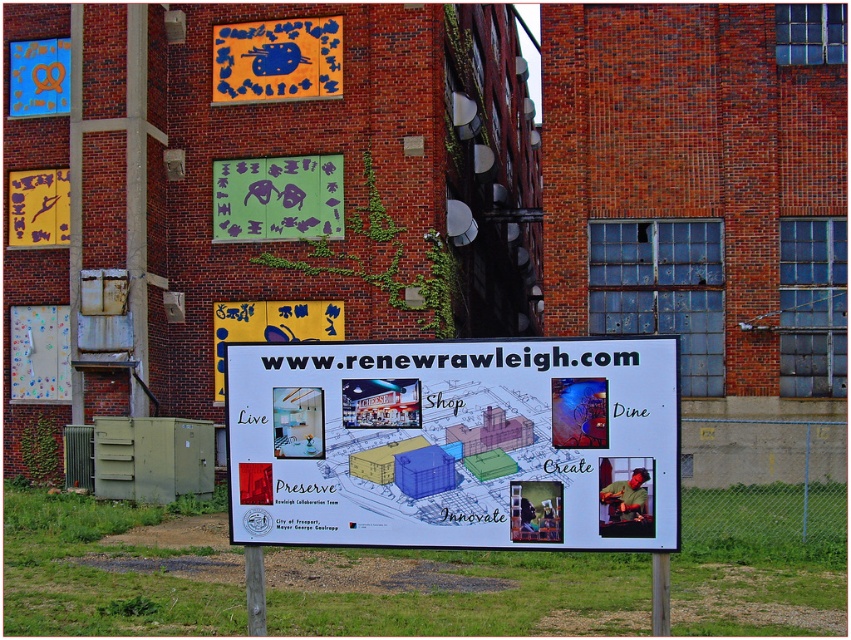
Question: Which object is positioned closest to the white paper sign at center?

Choices:
 (A) matte blue pretzel at upper left
 (B) green matte sign at center
 (C) yellow matte sign at center
 (D) blue fabric sign at upper center

Answer: (C)

Question: Does yellow matte sign at center appear on the left side of yellow matte sign at upper left?

Choices:
 (A) yes
 (B) no

Answer: (B)

Question: Does yellow matte sign at center have a smaller size compared to matte blue pretzel at upper left?

Choices:
 (A) yes
 (B) no

Answer: (B)

Question: Is white paper sign at center bigger than blue fabric sign at upper center?

Choices:
 (A) no
 (B) yes

Answer: (A)

Question: Which point is closer to the camera?

Choices:
 (A) yellow matte sign at center
 (B) matte blue pretzel at upper left
 (C) white paper sign at center

Answer: (C)

Question: Which point appears closest to the camera in this image?

Choices:
 (A) (295, 81)
 (B) (261, 193)

Answer: (B)